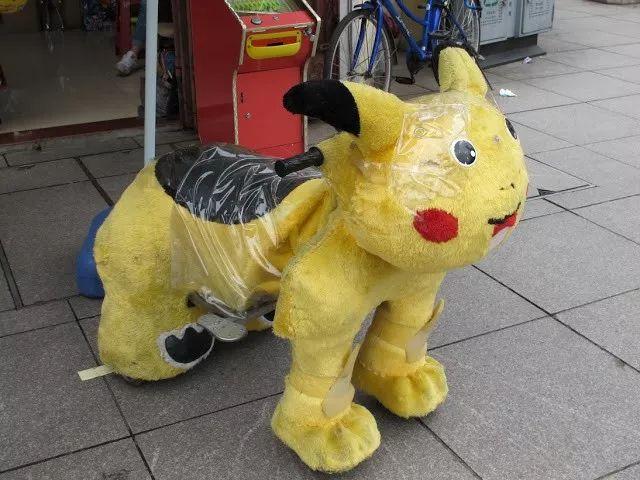
At what (x,y) coordinates should I click in order to perform the action: click on light gray tiled floor. Please return your answer as a coordinate pair (x, y). The width and height of the screenshot is (640, 480). Looking at the image, I should click on (502, 364).